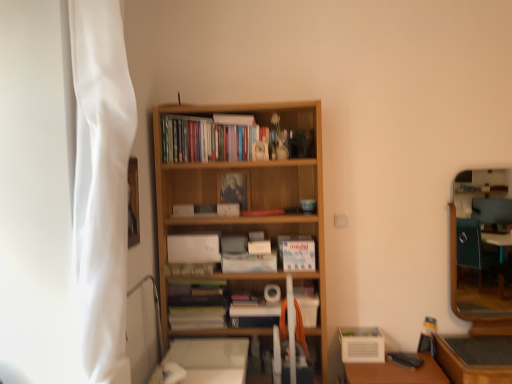
Question: From the image's perspective, is wooden bookcase at center below matte wooden frame at center, positioned as the fourth paperback book in bottom-to-top order?

Choices:
 (A) no
 (B) yes

Answer: (B)

Question: Does wooden bookcase at center have a greater width compared to matte wooden frame at center, the first paperback book positioned from the top?

Choices:
 (A) yes
 (B) no

Answer: (A)

Question: Does wooden bookcase at center have a greater height compared to matte wooden frame at center, positioned as the fourth paperback book in bottom-to-top order?

Choices:
 (A) yes
 (B) no

Answer: (A)

Question: Does wooden bookcase at center turn towards matte wooden frame at center, positioned as the fourth paperback book in bottom-to-top order?

Choices:
 (A) yes
 (B) no

Answer: (A)

Question: Is wooden bookcase at center at the left side of matte wooden frame at center, positioned as the fourth paperback book in bottom-to-top order?

Choices:
 (A) yes
 (B) no

Answer: (B)

Question: From a real-world perspective, is wooden bookcase at center on matte wooden frame at center, positioned as the fourth paperback book in bottom-to-top order?

Choices:
 (A) no
 (B) yes

Answer: (A)

Question: Is matte wooden frame at center, positioned as the fourth paperback book in bottom-to-top order, thinner than blue matte paperback book at center, which is the second paperback book from top to bottom?

Choices:
 (A) yes
 (B) no

Answer: (A)

Question: From a real-world perspective, is matte wooden frame at center, the first paperback book positioned from the top, located higher than blue matte paperback book at center, which is the second paperback book from top to bottom?

Choices:
 (A) yes
 (B) no

Answer: (A)

Question: Does matte wooden frame at center, the first paperback book positioned from the top, contain blue matte paperback book at center, which is the second paperback book from top to bottom?

Choices:
 (A) no
 (B) yes

Answer: (A)

Question: From the image's perspective, is matte wooden frame at center, positioned as the fourth paperback book in bottom-to-top order, located beneath blue matte paperback book at center, the 3th paperback book positioned from the bottom?

Choices:
 (A) no
 (B) yes

Answer: (A)

Question: From the image's perspective, is matte wooden frame at center, positioned as the fourth paperback book in bottom-to-top order, located above blue matte paperback book at center, which is the second paperback book from top to bottom?

Choices:
 (A) no
 (B) yes

Answer: (B)

Question: Is matte wooden frame at center, positioned as the fourth paperback book in bottom-to-top order, positioned far away from blue matte paperback book at center, the 3th paperback book positioned from the bottom?

Choices:
 (A) no
 (B) yes

Answer: (A)

Question: Is wooden table at lower right smaller than wooden bookcase at center?

Choices:
 (A) yes
 (B) no

Answer: (A)